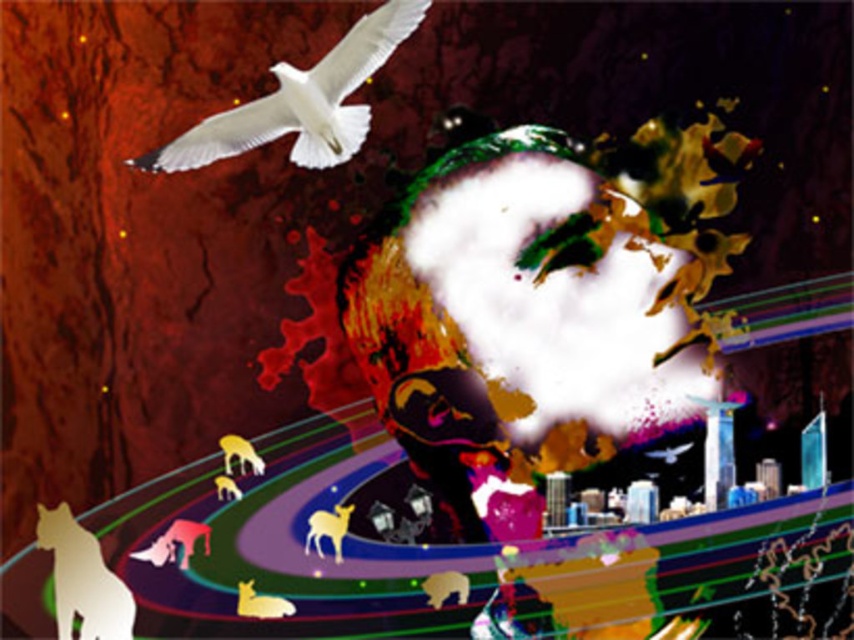
Question: Can you confirm if white glossy bird at upper left is positioned to the right of shiny brown bear at lower center?

Choices:
 (A) yes
 (B) no

Answer: (B)

Question: Among these points, which one is farthest from the camera?

Choices:
 (A) (337, 536)
 (B) (170, 538)

Answer: (B)

Question: Estimate the real-world distances between objects in this image. Which object is farther from the silvery metallic deer at lower left?

Choices:
 (A) silvery metallic horse at lower left
 (B) shiny gold deer at lower left

Answer: (B)

Question: Is white glossy bird at upper left positioned in front of shiny gold deer at center?

Choices:
 (A) no
 (B) yes

Answer: (B)

Question: Observing the image, what is the correct spatial positioning of silvery metallic horse at lower left in reference to silvery metallic deer at lower left?

Choices:
 (A) left
 (B) right

Answer: (A)

Question: Which point is closer to the camera taking this photo?

Choices:
 (A) (92, 589)
 (B) (235, 486)
 (C) (249, 452)

Answer: (A)